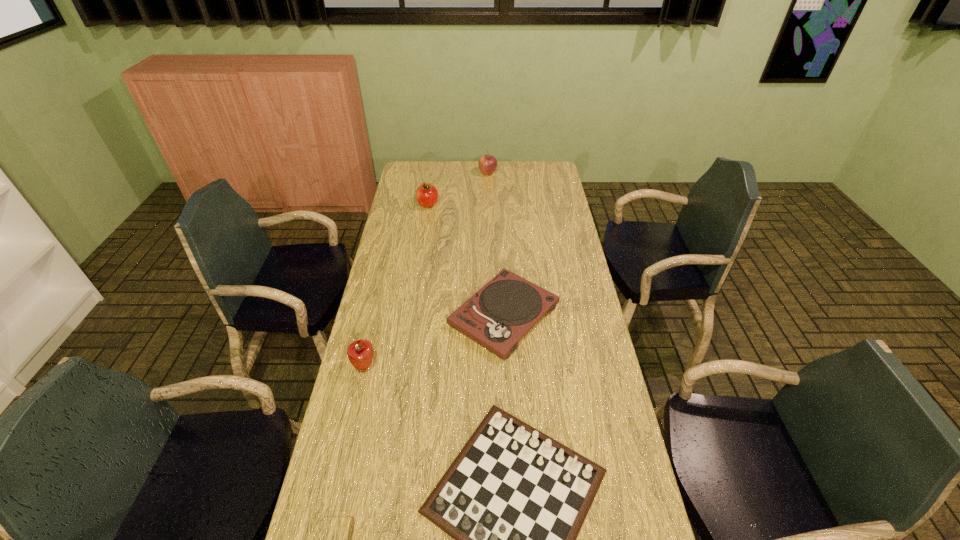
This screenshot has width=960, height=540. In order to click on empty location between the third object from left to right and the phonograph_record in this screenshot , I will do `click(466, 260)`.

Where is `unoccupied position between the nearest apple and the farthest object`? The image size is (960, 540). unoccupied position between the nearest apple and the farthest object is located at coordinates (426, 269).

Identify which object is the closest to the fifth nearest object. Please provide its 2D coordinates. Your answer should be formatted as a tuple, i.e. [(x, y)], where the tuple contains the x and y coordinates of a point satisfying the conditions above.

[(487, 164)]

Locate which object ranks second in proximity to the chessboard. Please provide its 2D coordinates. Your answer should be formatted as a tuple, i.e. [(x, y)], where the tuple contains the x and y coordinates of a point satisfying the conditions above.

[(497, 316)]

Locate an element on the screen. The image size is (960, 540). apple that is the closest to the phonograph_record is located at coordinates (360, 353).

Where is `apple that is the second closest to the leftmost apple`? The width and height of the screenshot is (960, 540). apple that is the second closest to the leftmost apple is located at coordinates (487, 164).

Where is `free location that satisfies the following two spatial constraints: 1. on the front side of the second farthest object; 2. on the right side of the phonograph_record`? This screenshot has height=540, width=960. free location that satisfies the following two spatial constraints: 1. on the front side of the second farthest object; 2. on the right side of the phonograph_record is located at coordinates (411, 315).